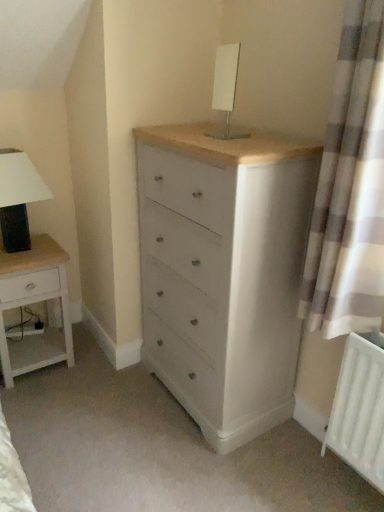
Question: Considering the relative positions of white matte radiator at lower right and matte black lampshade at left, which is the 1th table lamp from bottom to top, in the image provided, is white matte radiator at lower right to the right of matte black lampshade at left, which is the 1th table lamp from bottom to top, from the viewer's perspective?

Choices:
 (A) no
 (B) yes

Answer: (B)

Question: Is white matte radiator at lower right positioned with its back to matte black lampshade at left, which ranks as the 2th table lamp in right-to-left order?

Choices:
 (A) no
 (B) yes

Answer: (A)

Question: Is white matte radiator at lower right to the left of matte black lampshade at left, the second table lamp positioned from the front, from the viewer's perspective?

Choices:
 (A) no
 (B) yes

Answer: (A)

Question: Would you consider white matte radiator at lower right to be distant from matte black lampshade at left, the second table lamp positioned from the front?

Choices:
 (A) no
 (B) yes

Answer: (B)

Question: Can we say white matte radiator at lower right lies outside matte black lampshade at left, marked as the 1th table lamp in a back-to-front arrangement?

Choices:
 (A) no
 (B) yes

Answer: (B)

Question: From a real-world perspective, is white matte radiator at lower right physically above matte black lampshade at left, which appears as the first table lamp when viewed from the left?

Choices:
 (A) no
 (B) yes

Answer: (A)

Question: Is matte white chest of drawers at center taller than white matte radiator at lower right?

Choices:
 (A) yes
 (B) no

Answer: (A)

Question: Considering the relative sizes of matte white chest of drawers at center and white matte radiator at lower right in the image provided, is matte white chest of drawers at center smaller than white matte radiator at lower right?

Choices:
 (A) no
 (B) yes

Answer: (A)

Question: Considering the relative sizes of matte white chest of drawers at center and white matte radiator at lower right in the image provided, is matte white chest of drawers at center shorter than white matte radiator at lower right?

Choices:
 (A) yes
 (B) no

Answer: (B)

Question: From the image's perspective, does matte white chest of drawers at center appear lower than white matte radiator at lower right?

Choices:
 (A) yes
 (B) no

Answer: (B)

Question: Is matte white chest of drawers at center at the right side of white matte radiator at lower right?

Choices:
 (A) yes
 (B) no

Answer: (B)

Question: From the image's perspective, is matte white chest of drawers at center above white matte radiator at lower right?

Choices:
 (A) no
 (B) yes

Answer: (B)

Question: Can you confirm if white glossy table lamp at upper center, which is the 1th table lamp from top to bottom, is bigger than matte black lampshade at left, which is the 2th table lamp from top to bottom?

Choices:
 (A) yes
 (B) no

Answer: (B)